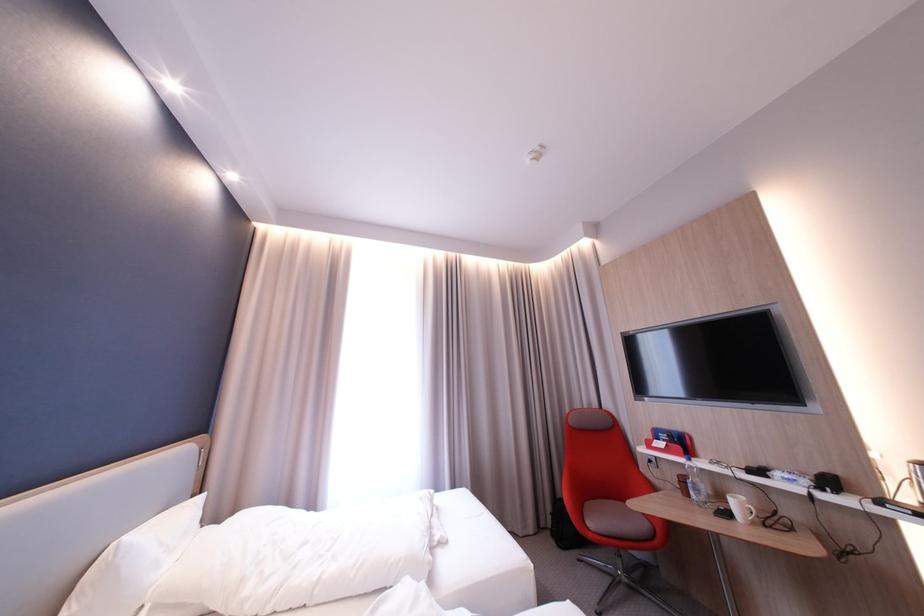
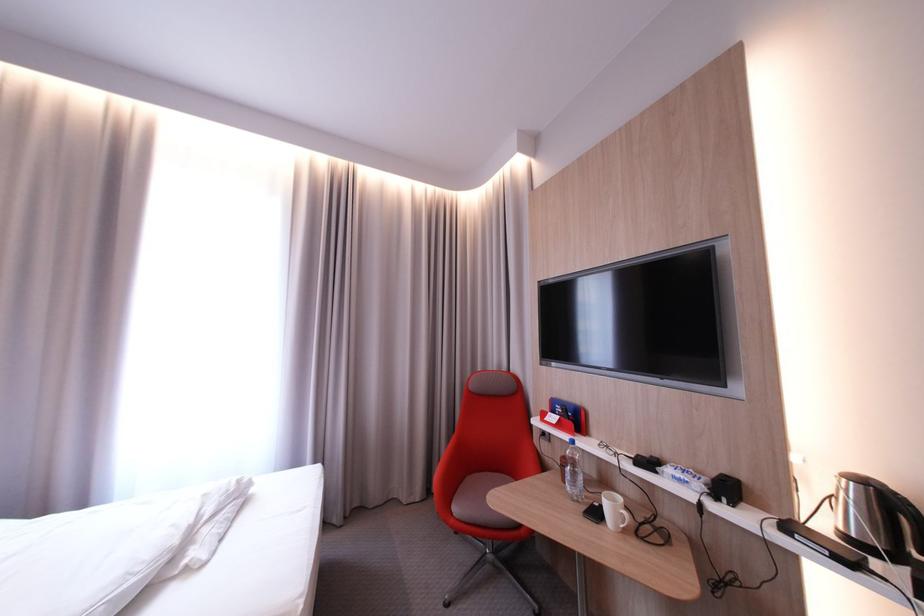
Locate, in the second image, the point that corresponds to point (748, 506) in the first image.

(623, 508)